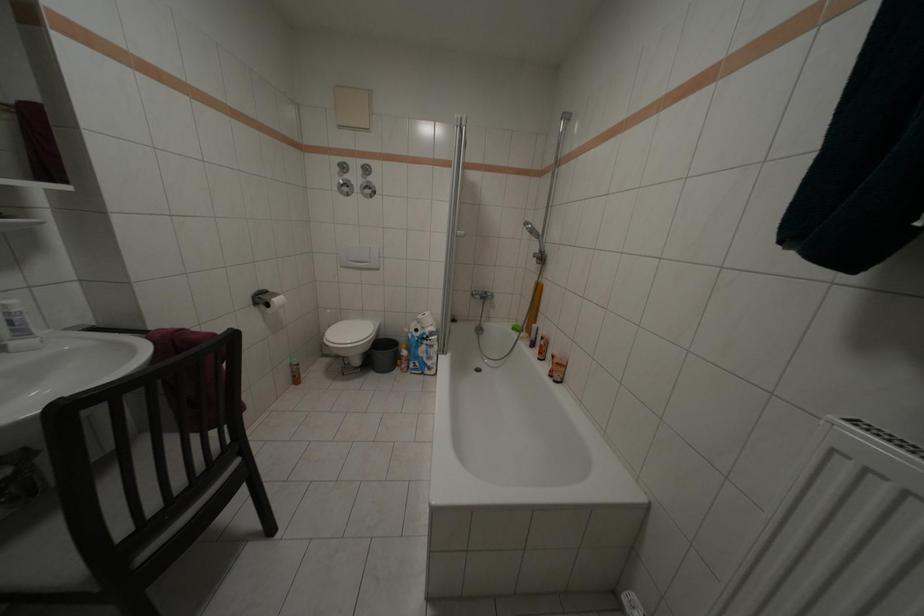
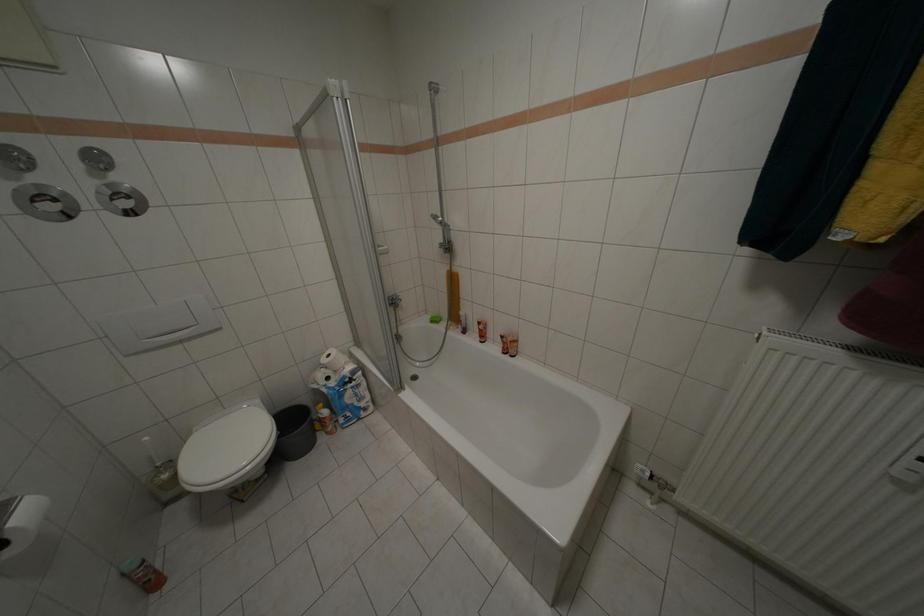
Question: The camera is either moving clockwise (left) or counter-clockwise (right) around the object. The first image is from the beginning of the video and the second image is from the end. Is the camera moving left or right when shooting the video?

Choices:
 (A) Left
 (B) Right

Answer: (A)